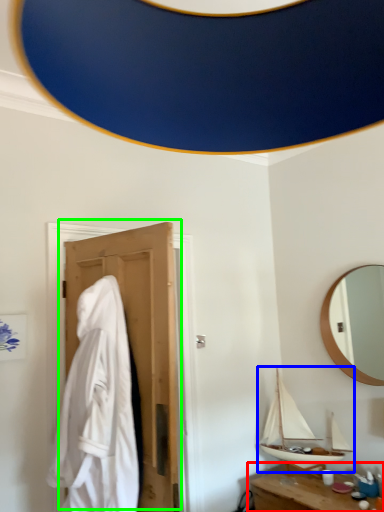
Question: Estimate the real-world distances between objects in this image. Which object is closer to table (highlighted by a red box), boat (highlighted by a blue box) or door (highlighted by a green box)?

Choices:
 (A) boat
 (B) door

Answer: (A)